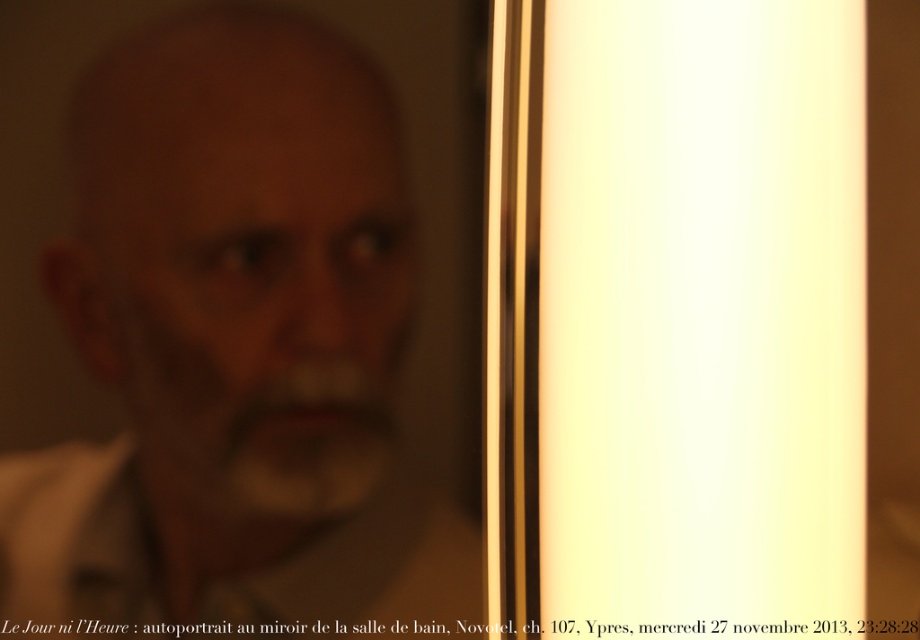
Question: Which object is the farthest from the brown matte beard at center?

Choices:
 (A) matte white face at center
 (B) white cotton dress shirt at left

Answer: (B)

Question: Which point is farther to the camera?

Choices:
 (A) (278, 484)
 (B) (132, 492)
 (C) (299, 458)

Answer: (C)

Question: Observing the image, what is the correct spatial positioning of matte white face at center in reference to brown matte beard at center?

Choices:
 (A) below
 (B) above

Answer: (B)

Question: Among these objects, which one is farthest from the camera?

Choices:
 (A) white cotton dress shirt at left
 (B) matte white face at center

Answer: (B)

Question: Is matte white face at center bigger than brown matte beard at center?

Choices:
 (A) yes
 (B) no

Answer: (A)

Question: From the image, what is the correct spatial relationship of matte white face at center in relation to brown matte beard at center?

Choices:
 (A) above
 (B) below

Answer: (A)